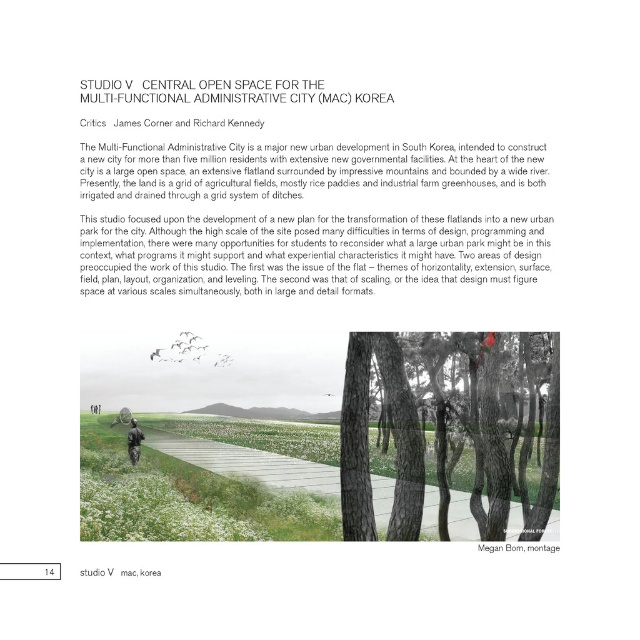
You are planning a picnic in the MAC park and want to set up a blanket on the green grass at lower center. However, there is a matte black person at center in the way. Can you place the blanket directly under the person without moving them?

The green grass at lower center is located below the matte black person at center, so yes, you can place the blanket directly under the person since the grass is positioned beneath them.

Based on the provided scene description, what can be inferred about the height comparison between the smooth bark tree at center and the green grass at lower center?

The smooth bark tree at center is not as tall as the green grass at lower center.

You are a visitor standing at the entrance of the MAC park. You see the smooth bark tree at center and the green grass at lower center. Which object is closer to you?

The smooth bark tree at center is closer to you than the green grass at lower center because it is positioned further to the viewer.